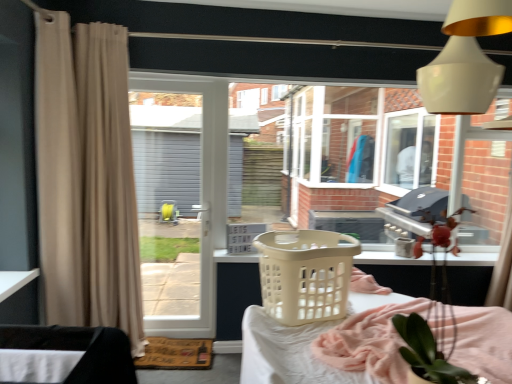
Question: Which direction should I rotate to face beige plastic laundry basket at lower center, the second furniture viewed from the left, — up or down?

Choices:
 (A) up
 (B) down

Answer: (B)

Question: Considering the relative positions of black fabric at lower left, the 1th furniture positioned from the front, and beige plastic laundry basket at lower center, the first furniture when ordered from right to left, in the image provided, is black fabric at lower left, the 1th furniture positioned from the front, to the right of beige plastic laundry basket at lower center, the first furniture when ordered from right to left, from the viewer's perspective?

Choices:
 (A) no
 (B) yes

Answer: (A)

Question: From the image's perspective, is black fabric at lower left, the 1th furniture positioned from the front, below beige plastic laundry basket at lower center, the second furniture in the front-to-back sequence?

Choices:
 (A) no
 (B) yes

Answer: (A)

Question: Is black fabric at lower left, which is the 2th furniture in right-to-left order, completely or partially outside of beige plastic laundry basket at lower center, the second furniture viewed from the left?

Choices:
 (A) no
 (B) yes

Answer: (B)

Question: Is black fabric at lower left, which is the 2th furniture in right-to-left order, facing towards beige plastic laundry basket at lower center, marked as the 1th furniture in a back-to-front arrangement?

Choices:
 (A) no
 (B) yes

Answer: (A)

Question: Is beige plastic laundry basket at lower center, marked as the 1th furniture in a back-to-front arrangement, inside black fabric at lower left, the 1th furniture positioned from the front?

Choices:
 (A) no
 (B) yes

Answer: (A)

Question: Considering the relative positions of black fabric at lower left, which is the 2th furniture in right-to-left order, and beige plastic laundry basket at lower center, marked as the 1th furniture in a back-to-front arrangement, in the image provided, is black fabric at lower left, which is the 2th furniture in right-to-left order, in front of beige plastic laundry basket at lower center, marked as the 1th furniture in a back-to-front arrangement,?

Choices:
 (A) yes
 (B) no

Answer: (A)

Question: Can you confirm if white fabric at lower left is positioned to the left of beige plastic basket at center, which is counted as the 2th basket, starting from the back?

Choices:
 (A) yes
 (B) no

Answer: (A)

Question: Is white fabric at lower left completely or partially outside of beige plastic basket at center, which is counted as the 2th basket, starting from the back?

Choices:
 (A) no
 (B) yes

Answer: (B)

Question: Can you confirm if white fabric at lower left is smaller than beige plastic basket at center, which is counted as the 2th basket, starting from the back?

Choices:
 (A) no
 (B) yes

Answer: (B)

Question: Is beige plastic basket at center, placed as the 1th basket when sorted from front to back, completely or partially inside white fabric at lower left?

Choices:
 (A) no
 (B) yes

Answer: (A)

Question: Could you tell me if white fabric at lower left is facing beige plastic basket at center, placed as the 1th basket when sorted from front to back?

Choices:
 (A) no
 (B) yes

Answer: (A)

Question: From the image's perspective, is white fabric at lower left located above beige plastic basket at center, placed as the 1th basket when sorted from front to back?

Choices:
 (A) no
 (B) yes

Answer: (A)

Question: Can you confirm if white plastic laundry basket at center, which is the 1th basket from back to front, is positioned to the right of beige fabric curtain at left, the 1th curtain when ordered from right to left?

Choices:
 (A) no
 (B) yes

Answer: (B)